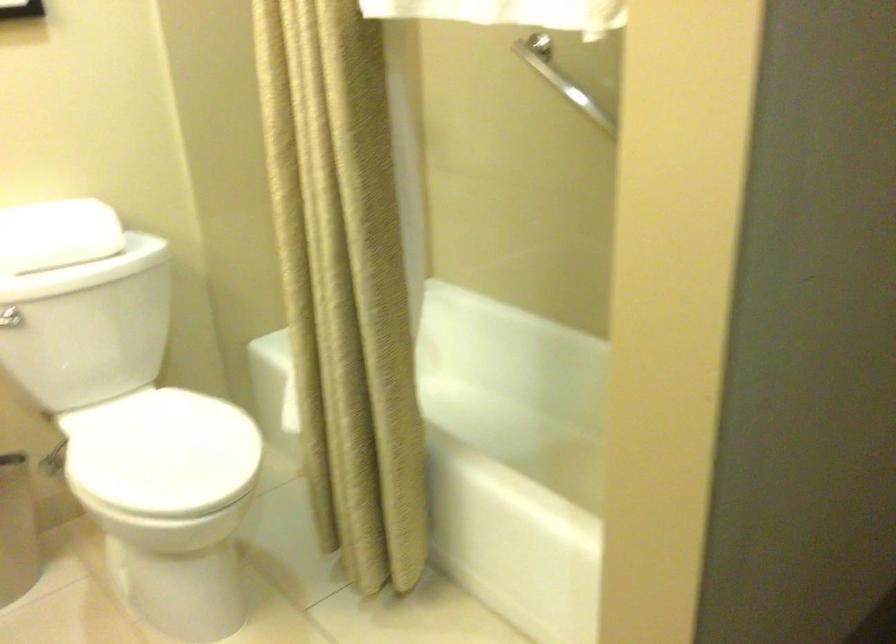
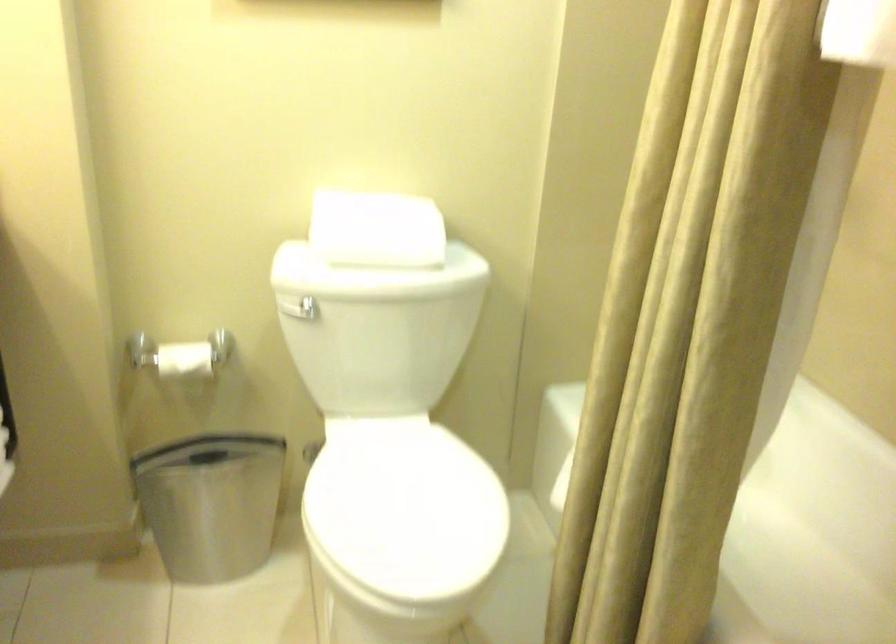
Question: The images are taken continuously from a first-person perspective. In which direction is your viewpoint rotating?

Choices:
 (A) Left
 (B) Right
 (C) Up
 (D) Down

Answer: (A)